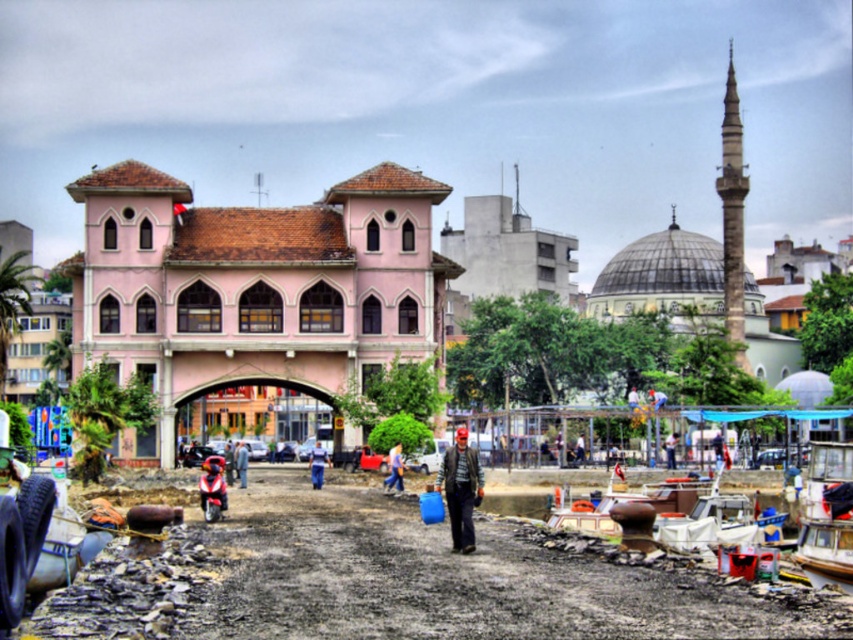
Question: From the image, what is the correct spatial relationship of gray woolen jacket at center in relation to blue fabric pants at center?

Choices:
 (A) left
 (B) right

Answer: (B)

Question: Based on their relative distances, which object is nearer to the white plastic boat at lower right?

Choices:
 (A) gray woolen jacket at center
 (B) blue denim jeans at center
 (C) blue fabric bag at center

Answer: (A)

Question: Does white plastic boat at lower right have a larger size compared to gray woolen jacket at center?

Choices:
 (A) yes
 (B) no

Answer: (B)

Question: Which point is farther to the camera?

Choices:
 (A) (395, 460)
 (B) (242, 474)
 (C) (849, 536)

Answer: (A)

Question: Which object is positioned closest to the blue fabric pants at center?

Choices:
 (A) wooden boat at lower right
 (B) gray woolen jacket at center

Answer: (B)

Question: Can you confirm if white plastic boat at lower right is positioned to the left of blue fabric pants at center?

Choices:
 (A) yes
 (B) no

Answer: (B)